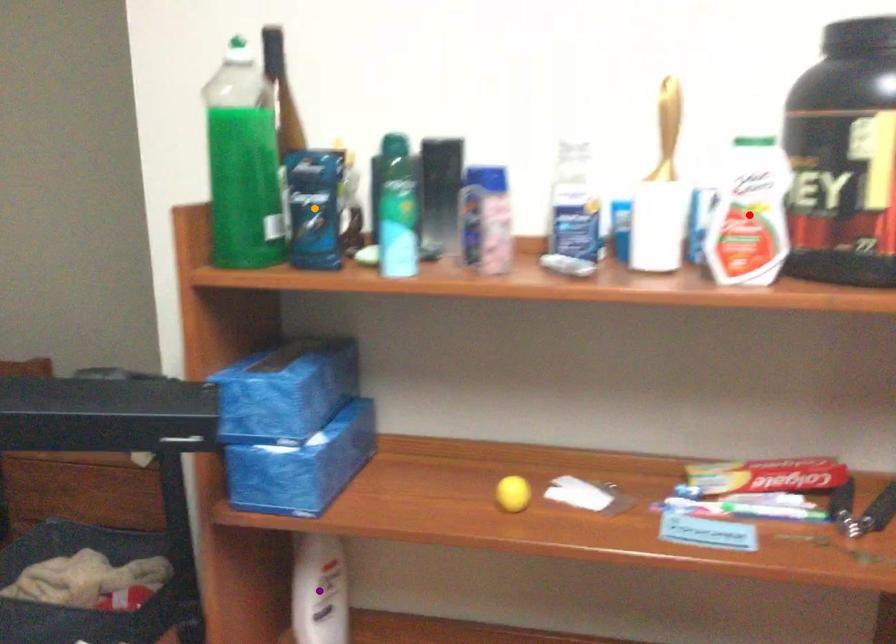
Order these from farthest to nearest:
purple point | orange point | red point

purple point < orange point < red point